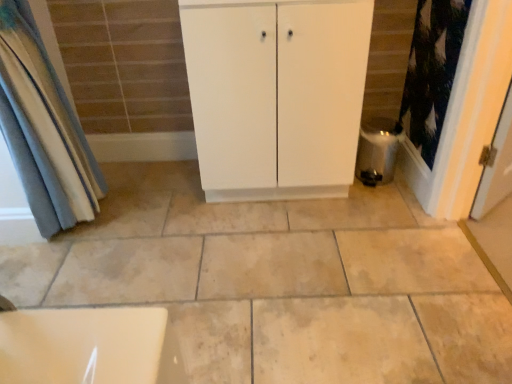
Where is `vacant space situated on the left part of white matte cabinet at center`? The width and height of the screenshot is (512, 384). vacant space situated on the left part of white matte cabinet at center is located at coordinates (159, 206).